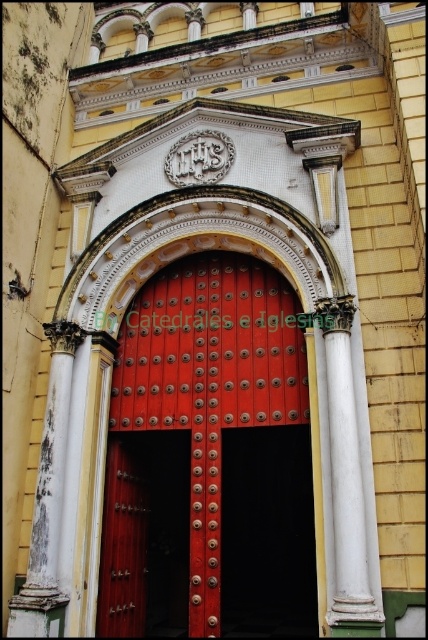
Is white marble column at center to the right of white weathered column at left from the viewer's perspective?

Yes, white marble column at center is to the right of white weathered column at left.

Is white marble column at center wider than white weathered column at left?

No, white marble column at center is not wider than white weathered column at left.

What do you see at coordinates (345, 480) in the screenshot?
I see `white marble column at center` at bounding box center [345, 480].

Where is `white marble column at center`? Image resolution: width=428 pixels, height=640 pixels. white marble column at center is located at coordinates (345, 480).

Who is positioned more to the left, shiny metal door at center or white marble column at center?

Positioned to the left is shiny metal door at center.

Locate an element on the screen. Image resolution: width=428 pixels, height=640 pixels. shiny metal door at center is located at coordinates (208, 458).

Between point (220, 552) and point (332, 612), which one is positioned behind?

Point (220, 552)

Identify the location of shiny metal door at center. (208, 458).

Can you confirm if shiny metal door at center is smaller than white weathered column at left?

Actually, shiny metal door at center might be larger than white weathered column at left.

The width and height of the screenshot is (428, 640). In order to click on shiny metal door at center in this screenshot , I will do click(x=208, y=458).